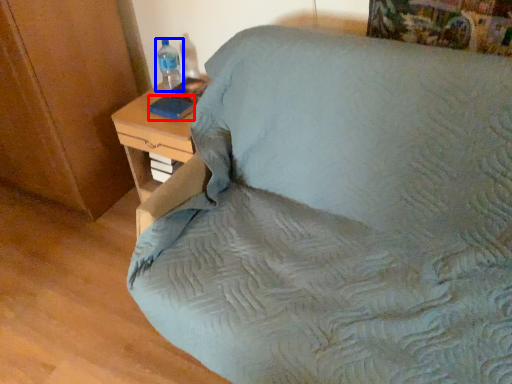
Question: Which point is further to the camera, pad (highlighted by a red box) or bottle (highlighted by a blue box)?

Choices:
 (A) pad
 (B) bottle

Answer: (B)